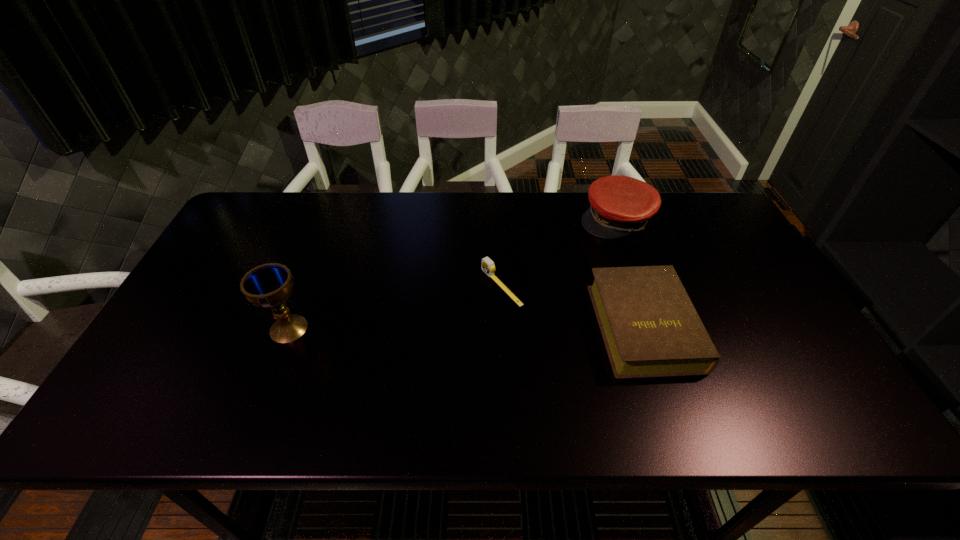
Find the location of `free space between the second tallest object and the third object from right to left`. free space between the second tallest object and the third object from right to left is located at coordinates (x=559, y=253).

Find the location of a particular element. The width and height of the screenshot is (960, 540). object that is the third closest to the tallest object is located at coordinates (620, 205).

Where is `the third closest object to the leftmost object`? the third closest object to the leftmost object is located at coordinates click(x=620, y=205).